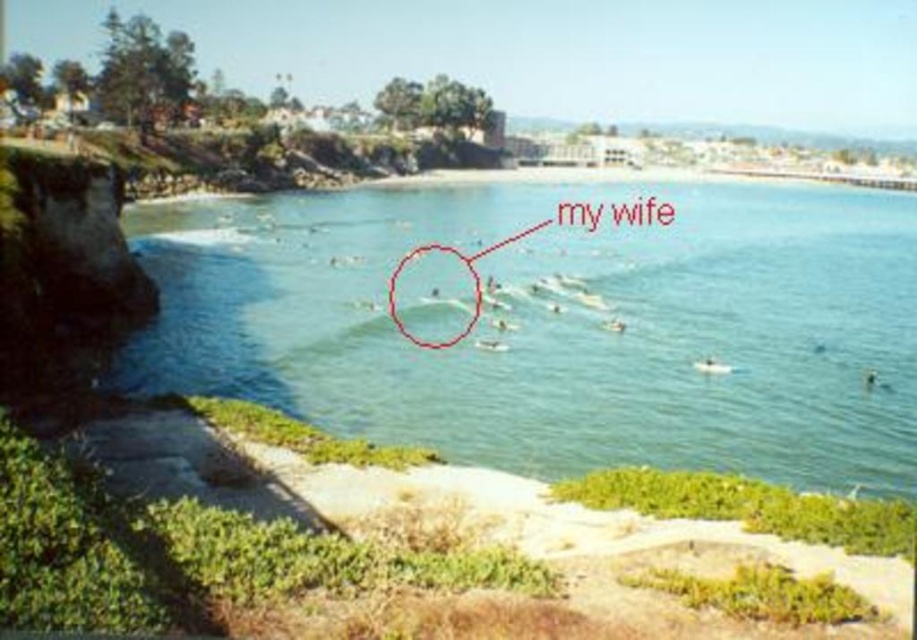
You are planning to place a small floating dock in the coastal scene. The dock needs to be placed where the clear blue water at center and smooth white surfboard at center are located. Which area should you choose to ensure the dock fits properly?

The clear blue water at center might be wider than the smooth white surfboard at center, so placing the dock where the clear blue water at center is located would likely provide enough space for the dock to fit properly.

You are a photographer trying to capture a photo of the clear blue water at center and the smooth white surfboard at center. Based on their positions, which object should you focus on first to ensure it appears sharp in the photo?

The clear blue water at center is in front of the smooth white surfboard at center. To ensure the clear blue water at center appears sharp, focus on it first since it is closer to the camera.